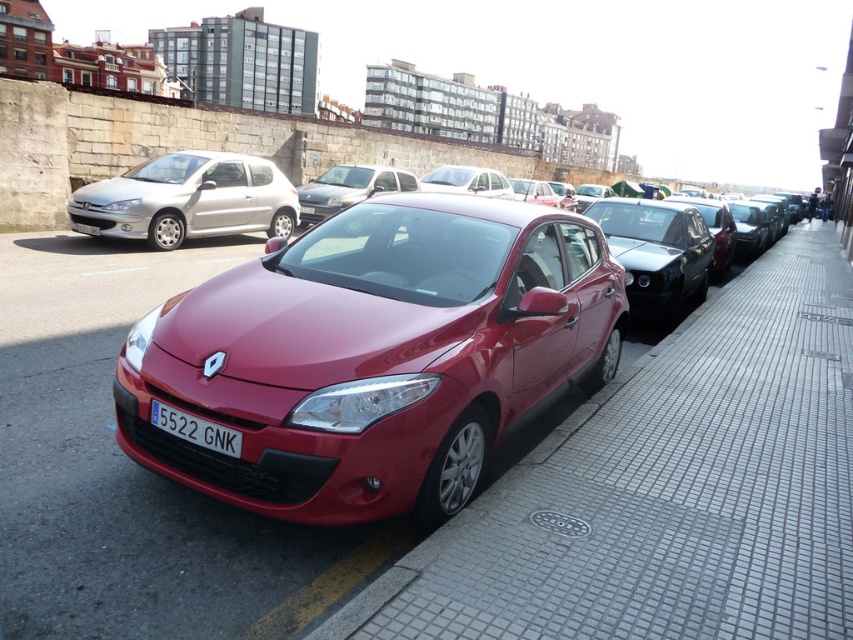
Question: Is gray brick pavement at center below metallic silver sedan at left?

Choices:
 (A) no
 (B) yes

Answer: (B)

Question: Which point appears closest to the camera in this image?

Choices:
 (A) (183, 211)
 (B) (343, 180)
 (C) (775, 412)

Answer: (C)

Question: Considering the real-world distances, which object is farthest from the satin black sedan at center?

Choices:
 (A) satin burgundy sedan at center
 (B) glossy black sedan at center
 (C) gray brick pavement at center

Answer: (A)

Question: Based on their relative distances, which object is nearer to the glossy black sedan at center?

Choices:
 (A) white glossy sedan at center
 (B) metallic silver sedan at left
 (C) white plastic license plate at center

Answer: (A)

Question: Can you confirm if metallic silver sedan at left is thinner than glossy black sedan at center?

Choices:
 (A) yes
 (B) no

Answer: (A)

Question: Can you confirm if gray brick pavement at center is positioned to the left of white glossy sedan at center?

Choices:
 (A) yes
 (B) no

Answer: (B)